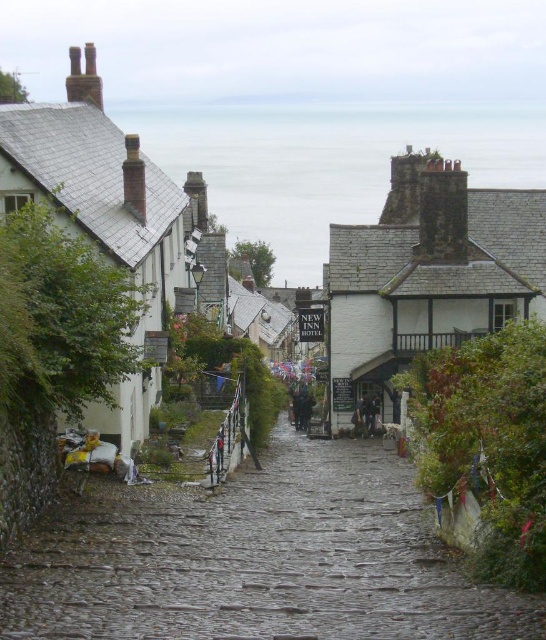
What are the coordinates of `cobblestone path at center` in the screenshot? It's located at (257, 560).

Where is `cobblestone path at center`? cobblestone path at center is located at coordinates click(x=257, y=560).

Locate an element on the screen. The height and width of the screenshot is (640, 546). cobblestone path at center is located at coordinates (257, 560).